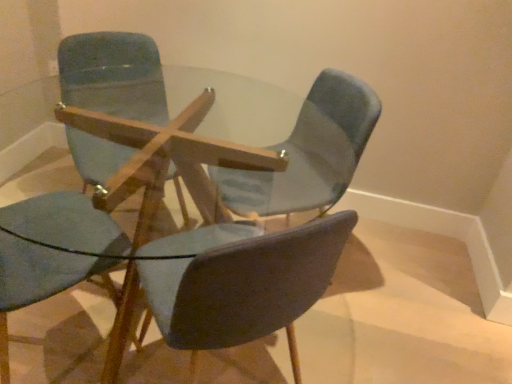
Question: From the image's perspective, does matte blue chair at upper left, marked as the 2th chair in a left-to-right arrangement, appear higher than matte blue chair at center, which is counted as the 3th chair, starting from the left?

Choices:
 (A) yes
 (B) no

Answer: (A)

Question: Does matte blue chair at upper left, the 3th chair positioned from the right, appear on the left side of matte blue chair at center, which is the second chair in right-to-left order?

Choices:
 (A) no
 (B) yes

Answer: (B)

Question: Can you confirm if matte blue chair at upper left, the 3th chair positioned from the right, is thinner than matte blue chair at center, which is counted as the 3th chair, starting from the left?

Choices:
 (A) yes
 (B) no

Answer: (A)

Question: From a real-world perspective, is matte blue chair at upper left, marked as the 2th chair in a left-to-right arrangement, located higher than matte blue chair at center, which is the second chair in right-to-left order?

Choices:
 (A) yes
 (B) no

Answer: (A)

Question: Is matte blue chair at upper left, the 3th chair positioned from the right, taller than matte blue chair at center, which is the second chair in right-to-left order?

Choices:
 (A) no
 (B) yes

Answer: (B)

Question: In terms of width, does matte blue chair at upper left, marked as the 2th chair in a left-to-right arrangement, look wider or thinner when compared to light blue fabric chair at center, which is the first chair from right to left?

Choices:
 (A) thin
 (B) wide

Answer: (A)

Question: From a real-world perspective, is matte blue chair at upper left, marked as the 2th chair in a left-to-right arrangement, physically located above or below light blue fabric chair at center, marked as the fourth chair in a left-to-right arrangement?

Choices:
 (A) above
 (B) below

Answer: (A)

Question: Is matte blue chair at upper left, marked as the 2th chair in a left-to-right arrangement, taller or shorter than light blue fabric chair at center, which is the first chair from right to left?

Choices:
 (A) tall
 (B) short

Answer: (A)

Question: Visually, is matte blue chair at upper left, marked as the 2th chair in a left-to-right arrangement, positioned to the left or to the right of light blue fabric chair at center, which is the first chair from right to left?

Choices:
 (A) right
 (B) left

Answer: (B)

Question: Is matte blue chair at upper left, the fourth chair viewed from the right, wider or thinner than matte blue chair at center, which is the second chair in right-to-left order?

Choices:
 (A) wide
 (B) thin

Answer: (B)

Question: From a real-world perspective, is matte blue chair at upper left, the fourth chair viewed from the right, positioned above or below matte blue chair at center, which is counted as the 3th chair, starting from the left?

Choices:
 (A) above
 (B) below

Answer: (A)

Question: Considering the positions of matte blue chair at upper left, the fourth chair viewed from the right, and matte blue chair at center, which is counted as the 3th chair, starting from the left, in the image, is matte blue chair at upper left, the fourth chair viewed from the right, taller or shorter than matte blue chair at center, which is counted as the 3th chair, starting from the left,?

Choices:
 (A) short
 (B) tall

Answer: (B)

Question: Which is correct: matte blue chair at upper left, the first chair viewed from the left, is inside matte blue chair at center, which is the second chair in right-to-left order, or outside of it?

Choices:
 (A) outside
 (B) inside

Answer: (A)

Question: In the image, is matte blue chair at center, which is counted as the 3th chair, starting from the left, on the left side or the right side of light blue fabric chair at center, marked as the fourth chair in a left-to-right arrangement?

Choices:
 (A) right
 (B) left

Answer: (B)

Question: In terms of height, does matte blue chair at center, which is counted as the 3th chair, starting from the left, look taller or shorter compared to light blue fabric chair at center, marked as the fourth chair in a left-to-right arrangement?

Choices:
 (A) tall
 (B) short

Answer: (B)